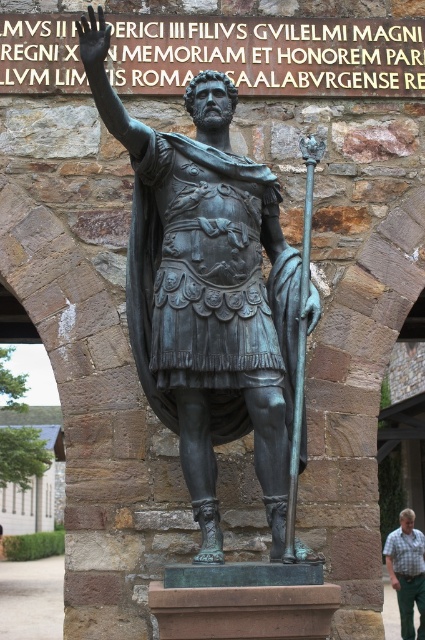
Who is higher up, bronze spear at center or green plaid shirt at lower right?

bronze spear at center is above.

Between point (312, 144) and point (385, 561), which one is positioned in front?

Positioned in front is point (312, 144).

Find the location of a particular element. bronze spear at center is located at coordinates (300, 344).

Does point (129, 116) come closer to viewer compared to point (285, 532)?

No, it is not.

Is point (249, 218) farther from camera compared to point (306, 144)?

No, (249, 218) is in front of (306, 144).

At what (x,y) coordinates should I click in order to perform the action: click on bronze statue at center. Please return your answer as a coordinate pair (x, y). Looking at the image, I should click on (206, 291).

Is bronze statue at center bigger than green plaid shirt at lower right?

Yes.

Does bronze statue at center have a greater width compared to green plaid shirt at lower right?

Indeed, bronze statue at center has a greater width compared to green plaid shirt at lower right.

Between point (204, 369) and point (402, 566), which one is positioned behind?

Positioned behind is point (402, 566).

The height and width of the screenshot is (640, 425). Find the location of `bronze statue at center`. bronze statue at center is located at coordinates (206, 291).